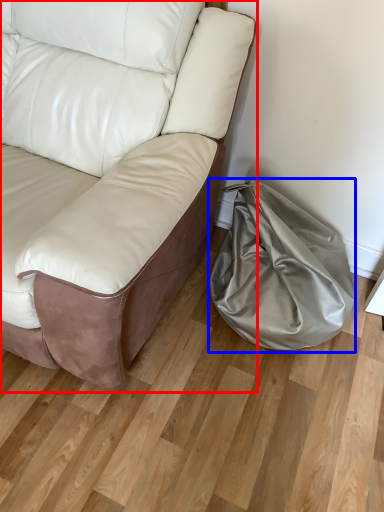
Question: Which object is closer to the camera taking this photo, studio couch (highlighted by a red box) or bean bag chair (highlighted by a blue box)?

Choices:
 (A) studio couch
 (B) bean bag chair

Answer: (A)